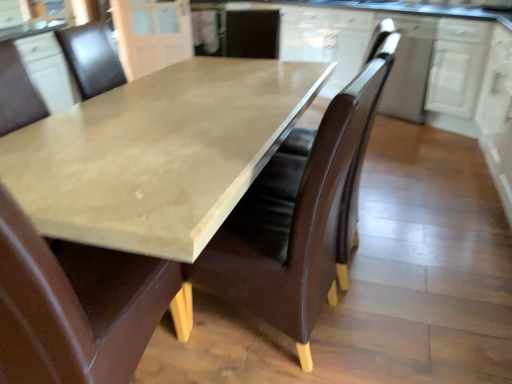
Looking at this image, in order to face white glossy cabinet at right, which appears as the 2th cabinetry when viewed from the right, should I rotate leftwards or rightwards?

A 32.400 degree turn to the right will do.

Find the location of a particular element. white glossy cabinet at upper center, the first cabinetry positioned from the left is located at coordinates (152, 34).

Describe the element at coordinates (74, 306) in the screenshot. I see `matte brown leather chair at center, marked as the 1th chair in a left-to-right arrangement` at that location.

In order to click on matte brown leather chair at center, the 2th chair in the left-to-right sequence in this screenshot , I will do `click(293, 221)`.

Find the location of a particular element. This screenshot has height=384, width=512. white glossy cabinet at upper right, which is counted as the fourth cabinetry, starting from the left is located at coordinates (457, 66).

Find the location of a particular element. white glossy cabinet at right, which appears as the 2th cabinetry when viewed from the right is located at coordinates (498, 115).

Looking at this image, relative to white glossy cabinet at upper center, marked as the 4th cabinetry in a right-to-left arrangement, is white glossy cabinet at upper right, placed as the 2th cabinetry when sorted from left to right, in front or behind?

Visually, white glossy cabinet at upper right, placed as the 2th cabinetry when sorted from left to right, is located in front of white glossy cabinet at upper center, marked as the 4th cabinetry in a right-to-left arrangement.

Is white glossy cabinet at upper right, the 3th cabinetry when ordered from right to left, to the left of white glossy cabinet at upper center, the first cabinetry positioned from the left, from the viewer's perspective?

In fact, white glossy cabinet at upper right, the 3th cabinetry when ordered from right to left, is to the right of white glossy cabinet at upper center, the first cabinetry positioned from the left.

Is point (392, 85) closer or farther from the camera than point (139, 50)?

Point (392, 85).

From the image's perspective, is white glossy cabinet at upper right, the 3th cabinetry when ordered from right to left, located above or below white glossy cabinet at upper center, the first cabinetry positioned from the left?

white glossy cabinet at upper right, the 3th cabinetry when ordered from right to left, is situated lower than white glossy cabinet at upper center, the first cabinetry positioned from the left, in the image.

From the picture: In the image, is white glossy cabinet at upper center, the first cabinetry positioned from the left, on the left side or the right side of matte concrete countertop at center?

In the image, white glossy cabinet at upper center, the first cabinetry positioned from the left, appears on the left side of matte concrete countertop at center.

Considering the sizes of white glossy cabinet at upper center, marked as the 4th cabinetry in a right-to-left arrangement, and matte concrete countertop at center in the image, is white glossy cabinet at upper center, marked as the 4th cabinetry in a right-to-left arrangement, wider or thinner than matte concrete countertop at center?

In the image, white glossy cabinet at upper center, marked as the 4th cabinetry in a right-to-left arrangement, appears to be more narrow than matte concrete countertop at center.

Which is correct: white glossy cabinet at upper center, the first cabinetry positioned from the left, is inside matte concrete countertop at center, or outside of it?

The correct answer is: outside.

Can you confirm if white glossy cabinet at upper center, marked as the 4th cabinetry in a right-to-left arrangement, is bigger than matte concrete countertop at center?

No, white glossy cabinet at upper center, marked as the 4th cabinetry in a right-to-left arrangement, is not bigger than matte concrete countertop at center.

Who is taller, white glossy cabinet at upper right, which is counted as the fourth cabinetry, starting from the left, or matte brown leather chair at center, the first chair from the right?

Standing taller between the two is matte brown leather chair at center, the first chair from the right.

Does point (469, 27) come behind point (385, 68)?

Yes, point (469, 27) is behind point (385, 68).

Would you say white glossy cabinet at upper right, arranged as the first cabinetry when viewed from the right, is to the left or to the right of matte brown leather chair at center, the 2th chair in the left-to-right sequence, in the picture?

Based on their positions, white glossy cabinet at upper right, arranged as the first cabinetry when viewed from the right, is located to the right of matte brown leather chair at center, the 2th chair in the left-to-right sequence.

You are a GUI agent. You are given a task and a screenshot of the screen. Output one action in this format:
    pyautogui.click(x=<x>, y=<y>)
    Task: Click on the cabinetry that is the 3rd one when counting rightward from the matte brown leather chair at center, the 2th chair in the left-to-right sequence
    
    Given the screenshot: What is the action you would take?
    pyautogui.click(x=457, y=66)

What are the coordinates of `the 2nd chair in front of the white glossy cabinet at upper center, marked as the 4th cabinetry in a right-to-left arrangement` in the screenshot? It's located at (74, 306).

Is matte brown leather chair at center, the second chair viewed from the right, looking in the opposite direction of white glossy cabinet at upper center, marked as the 4th cabinetry in a right-to-left arrangement?

No, matte brown leather chair at center, the second chair viewed from the right, is not facing the opposite direction of white glossy cabinet at upper center, marked as the 4th cabinetry in a right-to-left arrangement.

Consider the image. From the image's perspective, which one is positioned lower, matte brown leather chair at center, marked as the 1th chair in a left-to-right arrangement, or white glossy cabinet at upper center, marked as the 4th cabinetry in a right-to-left arrangement?

matte brown leather chair at center, marked as the 1th chair in a left-to-right arrangement.

Does matte brown leather chair at center, the second chair viewed from the right, have a smaller size compared to white glossy cabinet at upper center, marked as the 4th cabinetry in a right-to-left arrangement?

No.

Is brown leather swivel chair at center a part of matte brown leather chair at center, marked as the 1th chair in a left-to-right arrangement?

No, brown leather swivel chair at center is located outside of matte brown leather chair at center, marked as the 1th chair in a left-to-right arrangement.

Considering the relative sizes of matte brown leather chair at center, marked as the 1th chair in a left-to-right arrangement, and brown leather swivel chair at center in the image provided, is matte brown leather chair at center, marked as the 1th chair in a left-to-right arrangement, smaller than brown leather swivel chair at center?

No, matte brown leather chair at center, marked as the 1th chair in a left-to-right arrangement, is not smaller than brown leather swivel chair at center.

Is matte brown leather chair at center, the second chair viewed from the right, closer to the viewer compared to brown leather swivel chair at center?

Yes, the depth of matte brown leather chair at center, the second chair viewed from the right, is less than that of brown leather swivel chair at center.

Locate an element on the screen. the 2nd chair to the left when counting from the brown leather swivel chair at center is located at coordinates (74, 306).

Locate an element on the screen. the 2nd chair positioned below the white glossy cabinet at right, which appears as the 2th cabinetry when viewed from the right (from the image's perspective) is located at coordinates (74, 306).

Are matte brown leather chair at center, the second chair viewed from the right, and white glossy cabinet at right, which appears as the 2th cabinetry when viewed from the right, making contact?

No, matte brown leather chair at center, the second chair viewed from the right, is not with white glossy cabinet at right, which appears as the 2th cabinetry when viewed from the right.

In terms of height, does matte brown leather chair at center, marked as the 1th chair in a left-to-right arrangement, look taller or shorter compared to white glossy cabinet at right, which appears as the 2th cabinetry when viewed from the right?

matte brown leather chair at center, marked as the 1th chair in a left-to-right arrangement, is taller than white glossy cabinet at right, which appears as the 2th cabinetry when viewed from the right.

In the image, is matte brown leather chair at center, marked as the 1th chair in a left-to-right arrangement, positioned in front of or behind white glossy cabinet at right, which appears as the 2th cabinetry when viewed from the right?

matte brown leather chair at center, marked as the 1th chair in a left-to-right arrangement, is positioned closer to the viewer than white glossy cabinet at right, which appears as the 2th cabinetry when viewed from the right.

Is white glossy cabinet at upper center, the first cabinetry positioned from the left, at the left side of white glossy cabinet at right, positioned as the third cabinetry in left-to-right order?

Indeed, white glossy cabinet at upper center, the first cabinetry positioned from the left, is positioned on the left side of white glossy cabinet at right, positioned as the third cabinetry in left-to-right order.

Can you tell me how much white glossy cabinet at upper center, the first cabinetry positioned from the left, and white glossy cabinet at right, positioned as the third cabinetry in left-to-right order, differ in facing direction?

There is a 105-degree angle between the facing directions of white glossy cabinet at upper center, the first cabinetry positioned from the left, and white glossy cabinet at right, positioned as the third cabinetry in left-to-right order.

Which object is closer to the camera taking this photo, white glossy cabinet at upper center, the first cabinetry positioned from the left, or white glossy cabinet at right, positioned as the third cabinetry in left-to-right order?

white glossy cabinet at right, positioned as the third cabinetry in left-to-right order.

From the image's perspective, which object appears higher, white glossy cabinet at upper center, marked as the 4th cabinetry in a right-to-left arrangement, or white glossy cabinet at right, positioned as the third cabinetry in left-to-right order?

white glossy cabinet at upper center, marked as the 4th cabinetry in a right-to-left arrangement, from the image's perspective.

From the white glossy cabinet at upper center, marked as the 4th cabinetry in a right-to-left arrangement, count 1st cabinetrys forward and point to it. Please provide its 2D coordinates.

[(409, 67)]

I want to click on the 4th cabinetry behind the matte concrete countertop at center, so click(x=152, y=34).

Based on their spatial positions, is matte brown leather chair at center, the second chair viewed from the right, or white glossy cabinet at right, positioned as the third cabinetry in left-to-right order, further from white glossy cabinet at upper right, which is counted as the fourth cabinetry, starting from the left?

Among the two, matte brown leather chair at center, the second chair viewed from the right, is located further to white glossy cabinet at upper right, which is counted as the fourth cabinetry, starting from the left.

Considering their positions, is matte brown leather chair at center, marked as the 1th chair in a left-to-right arrangement, positioned closer to white glossy cabinet at right, which appears as the 2th cabinetry when viewed from the right, than white glossy cabinet at upper right, placed as the 2th cabinetry when sorted from left to right?

The object closer to white glossy cabinet at right, which appears as the 2th cabinetry when viewed from the right, is white glossy cabinet at upper right, placed as the 2th cabinetry when sorted from left to right.

Which object lies further to the anchor point white glossy cabinet at upper right, which is counted as the fourth cabinetry, starting from the left, white glossy cabinet at upper right, the 3th cabinetry when ordered from right to left, or white glossy cabinet at upper center, marked as the 4th cabinetry in a right-to-left arrangement?

white glossy cabinet at upper center, marked as the 4th cabinetry in a right-to-left arrangement.

Estimate the real-world distances between objects in this image. Which object is closer to matte brown leather chair at center, the 2th chair in the left-to-right sequence, white glossy cabinet at upper right, which is counted as the fourth cabinetry, starting from the left, or matte brown leather chair at center, the second chair viewed from the right?

matte brown leather chair at center, the second chair viewed from the right.

Looking at the image, which one is located further to matte brown leather chair at center, the second chair viewed from the right, matte concrete countertop at center or matte brown leather chair at center, the 2th chair in the left-to-right sequence?

Among the two, matte concrete countertop at center is located further to matte brown leather chair at center, the second chair viewed from the right.

Considering their positions, is brown leather swivel chair at center positioned further to matte brown leather chair at center, the first chair from the right, than white glossy cabinet at upper right, placed as the 2th cabinetry when sorted from left to right?

Among the two, white glossy cabinet at upper right, placed as the 2th cabinetry when sorted from left to right, is located further to matte brown leather chair at center, the first chair from the right.

Based on their spatial positions, is matte brown leather chair at center, marked as the 1th chair in a left-to-right arrangement, or white glossy cabinet at upper right, arranged as the first cabinetry when viewed from the right, further from white glossy cabinet at upper right, placed as the 2th cabinetry when sorted from left to right?

matte brown leather chair at center, marked as the 1th chair in a left-to-right arrangement, is further to white glossy cabinet at upper right, placed as the 2th cabinetry when sorted from left to right.

When comparing their distances from matte brown leather chair at center, the 2th chair in the left-to-right sequence, does matte brown leather chair at center, marked as the 1th chair in a left-to-right arrangement, or white glossy cabinet at upper center, the first cabinetry positioned from the left, seem further?

The object further to matte brown leather chair at center, the 2th chair in the left-to-right sequence, is white glossy cabinet at upper center, the first cabinetry positioned from the left.

I want to click on swivel chair situated between matte concrete countertop at center and white glossy cabinet at right, positioned as the third cabinetry in left-to-right order, from left to right, so click(x=352, y=203).

Identify the location of chair between matte concrete countertop at center and white glossy cabinet at upper center, the first cabinetry positioned from the left, from front to back. (293, 221).

Identify the location of swivel chair between matte brown leather chair at center, the first chair from the right, and white glossy cabinet at right, which appears as the 2th cabinetry when viewed from the right. Image resolution: width=512 pixels, height=384 pixels. (352, 203).

Locate an element on the screen. cabinetry situated between white glossy cabinet at upper center, the first cabinetry positioned from the left, and white glossy cabinet at right, positioned as the third cabinetry in left-to-right order, from left to right is located at coordinates click(409, 67).